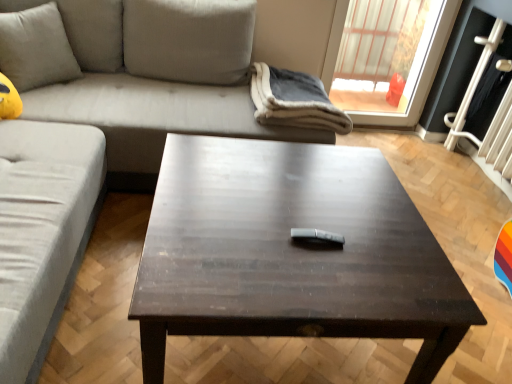
The height and width of the screenshot is (384, 512). In order to click on free space behind satin silver remote at center in this screenshot , I will do `click(316, 209)`.